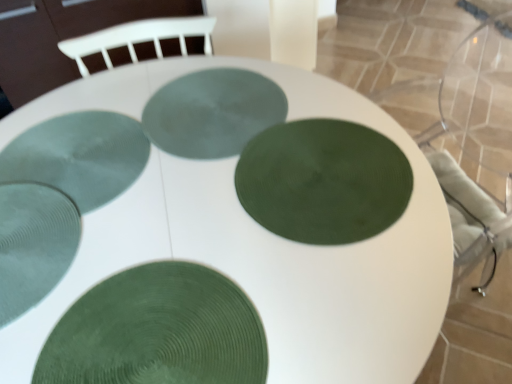
How much space does green textured glass plate at center, which ranks as the third glass plate in front-to-back order, occupy horizontally?

15.52 inches.

At what (x,y) coordinates should I click in order to perform the action: click on green textured glass plate at center, which appears as the 5th glass plate when viewed from the front. Please return your answer as a coordinate pair (x, y). Looking at the image, I should click on (213, 112).

Find the location of a particular element. The height and width of the screenshot is (384, 512). green textured glass plate at center, positioned as the 2th glass plate in back-to-front order is located at coordinates (79, 156).

Where is `green textured plate at center, which appears as the first glass plate when viewed from the front`? This screenshot has height=384, width=512. green textured plate at center, which appears as the first glass plate when viewed from the front is located at coordinates (158, 331).

How different are the orientations of green textured glass plate at center, which appears as the 5th glass plate when viewed from the front, and green textured plate at center, which is the 5th glass plate from back to front, in degrees?

They differ by 176 degrees in their facing directions.

Is green textured glass plate at center, which appears as the 5th glass plate when viewed from the front, aimed at green textured plate at center, which is the 5th glass plate from back to front?

No, green textured glass plate at center, which appears as the 5th glass plate when viewed from the front, is not oriented towards green textured plate at center, which is the 5th glass plate from back to front.

Considering the relative positions of green textured glass plate at center, which appears as the 5th glass plate when viewed from the front, and green textured plate at center, which is the 5th glass plate from back to front, in the image provided, is green textured glass plate at center, which appears as the 5th glass plate when viewed from the front, to the right of green textured plate at center, which is the 5th glass plate from back to front, from the viewer's perspective?

Indeed, green textured glass plate at center, which appears as the 5th glass plate when viewed from the front, is positioned on the right side of green textured plate at center, which is the 5th glass plate from back to front.

Do you think clear textured glass at bottom left, positioned as the 2th glass plate in front-to-back order, is within green textured glass plate at center, positioned as the 2th glass plate in back-to-front order, or outside of it?

clear textured glass at bottom left, positioned as the 2th glass plate in front-to-back order, cannot be found inside green textured glass plate at center, positioned as the 2th glass plate in back-to-front order.

How many degrees apart are the facing directions of clear textured glass at bottom left, the fourth glass plate from the back, and green textured glass plate at center, arranged as the fourth glass plate when viewed from the front?

There is a 48.5-degree angle between the facing directions of clear textured glass at bottom left, the fourth glass plate from the back, and green textured glass plate at center, arranged as the fourth glass plate when viewed from the front.

Measure the distance between clear textured glass at bottom left, positioned as the 2th glass plate in front-to-back order, and green textured glass plate at center, arranged as the fourth glass plate when viewed from the front.

clear textured glass at bottom left, positioned as the 2th glass plate in front-to-back order, and green textured glass plate at center, arranged as the fourth glass plate when viewed from the front, are 5.11 inches apart from each other.

Is clear textured glass at bottom left, positioned as the 2th glass plate in front-to-back order, far from green textured glass plate at center, positioned as the 2th glass plate in back-to-front order?

No.

Does point (239, 327) appear closer or farther from the camera than point (27, 243)?

Clearly, point (239, 327) is closer to the camera than point (27, 243).

Is green textured plate at center, which appears as the first glass plate when viewed from the front, not inside clear textured glass at bottom left, positioned as the 2th glass plate in front-to-back order?

green textured plate at center, which appears as the first glass plate when viewed from the front, lies outside clear textured glass at bottom left, positioned as the 2th glass plate in front-to-back order,'s area.

From the image's perspective, which one is positioned higher, green textured plate at center, which is the 5th glass plate from back to front, or clear textured glass at bottom left, positioned as the 2th glass plate in front-to-back order?

clear textured glass at bottom left, positioned as the 2th glass plate in front-to-back order, from the image's perspective.

Could you tell me if green textured plate at center, which is the 5th glass plate from back to front, is facing clear textured glass at bottom left, positioned as the 2th glass plate in front-to-back order?

No, green textured plate at center, which is the 5th glass plate from back to front, is not aimed at clear textured glass at bottom left, positioned as the 2th glass plate in front-to-back order.

Is the position of green textured glass plate at center, which ranks as the third glass plate in front-to-back order, more distant than that of green textured glass plate at center, which is the 1th glass plate in back-to-front order?

No.

Based on the photo, is green textured glass plate at center, positioned as the 3th glass plate in back-to-front order, not near green textured glass plate at center, which is the 1th glass plate in back-to-front order?

green textured glass plate at center, positioned as the 3th glass plate in back-to-front order, is actually quite close to green textured glass plate at center, which is the 1th glass plate in back-to-front order.

Is point (405, 164) behind point (280, 101)?

No, (405, 164) is closer to viewer.

From the picture: Can you confirm if green textured glass plate at center, which ranks as the third glass plate in front-to-back order, is shorter than green textured glass plate at center, which appears as the 5th glass plate when viewed from the front?

Yes.

Could you measure the distance between green textured glass plate at center, arranged as the fourth glass plate when viewed from the front, and clear textured glass at bottom left, positioned as the 2th glass plate in front-to-back order?

They are 5.11 inches apart.

In the image, is green textured glass plate at center, arranged as the fourth glass plate when viewed from the front, on the left side or the right side of clear textured glass at bottom left, positioned as the 2th glass plate in front-to-back order?

In the image, green textured glass plate at center, arranged as the fourth glass plate when viewed from the front, appears on the right side of clear textured glass at bottom left, positioned as the 2th glass plate in front-to-back order.

Does green textured glass plate at center, arranged as the fourth glass plate when viewed from the front, contain clear textured glass at bottom left, the fourth glass plate from the back?

No, clear textured glass at bottom left, the fourth glass plate from the back, is not a part of green textured glass plate at center, arranged as the fourth glass plate when viewed from the front.

Which is more to the left, clear textured glass at bottom left, positioned as the 2th glass plate in front-to-back order, or green textured plate at center, which appears as the first glass plate when viewed from the front?

clear textured glass at bottom left, positioned as the 2th glass plate in front-to-back order.

Which is correct: clear textured glass at bottom left, positioned as the 2th glass plate in front-to-back order, is inside green textured plate at center, which is the 5th glass plate from back to front, or outside of it?

The correct answer is: outside.

You are a GUI agent. You are given a task and a screenshot of the screen. Output one action in this format:
    pyautogui.click(x=<x>, y=<y>)
    Task: Click on the 2nd glass plate counting from the left side of the green textured plate at center, which is the 5th glass plate from back to front
    
    Given the screenshot: What is the action you would take?
    pyautogui.click(x=33, y=244)

Based on the photo, which object is further away from the camera taking this photo, clear textured glass at bottom left, the fourth glass plate from the back, or green textured plate at center, which is the 5th glass plate from back to front?

clear textured glass at bottom left, the fourth glass plate from the back, is further away from the camera.

Can you confirm if green textured glass plate at center, positioned as the 2th glass plate in back-to-front order, is wider than green textured glass plate at center, which appears as the 5th glass plate when viewed from the front?

Yes.

Is green textured glass plate at center, arranged as the fourth glass plate when viewed from the front, at the right side of green textured glass plate at center, which is the 1th glass plate in back-to-front order?

No.

Could green textured glass plate at center, which appears as the 5th glass plate when viewed from the front, be considered to be inside green textured glass plate at center, positioned as the 2th glass plate in back-to-front order?

No, green textured glass plate at center, which appears as the 5th glass plate when viewed from the front, is not a part of green textured glass plate at center, positioned as the 2th glass plate in back-to-front order.

Who is shorter, green textured glass plate at center, arranged as the fourth glass plate when viewed from the front, or green textured glass plate at center, which appears as the 5th glass plate when viewed from the front?

Standing shorter between the two is green textured glass plate at center, which appears as the 5th glass plate when viewed from the front.

From the green textured plate at center, which is the 5th glass plate from back to front, count 4th glass plates backward and point to it. Please provide its 2D coordinates.

[(213, 112)]

In order to click on the 2nd glass plate above the clear textured glass at bottom left, positioned as the 2th glass plate in front-to-back order (from the image's perspective) in this screenshot , I will do `click(79, 156)`.

From the image, which object appears to be farther from green textured glass plate at center, which appears as the 5th glass plate when viewed from the front, green textured glass plate at center, which ranks as the third glass plate in front-to-back order, or clear textured glass at bottom left, positioned as the 2th glass plate in front-to-back order?

clear textured glass at bottom left, positioned as the 2th glass plate in front-to-back order.

Consider the image. From the image, which object appears to be nearer to green textured glass plate at center, which ranks as the third glass plate in front-to-back order, green textured glass plate at center, which is the 1th glass plate in back-to-front order, or green textured glass plate at center, positioned as the 2th glass plate in back-to-front order?

green textured glass plate at center, which is the 1th glass plate in back-to-front order, lies closer to green textured glass plate at center, which ranks as the third glass plate in front-to-back order, than the other object.

When comparing their distances from green textured glass plate at center, positioned as the 2th glass plate in back-to-front order, does green textured glass plate at center, which is the 1th glass plate in back-to-front order, or green textured plate at center, which is the 5th glass plate from back to front, seem further?

Based on the image, green textured plate at center, which is the 5th glass plate from back to front, appears to be further to green textured glass plate at center, positioned as the 2th glass plate in back-to-front order.

Which object lies nearer to the anchor point clear textured glass at bottom left, positioned as the 2th glass plate in front-to-back order, green textured plate at center, which is the 5th glass plate from back to front, or green textured glass plate at center, arranged as the fourth glass plate when viewed from the front?

Based on the image, green textured glass plate at center, arranged as the fourth glass plate when viewed from the front, appears to be nearer to clear textured glass at bottom left, positioned as the 2th glass plate in front-to-back order.

Considering their positions, is clear textured glass at bottom left, the fourth glass plate from the back, positioned further to green textured glass plate at center, which appears as the 5th glass plate when viewed from the front, than green textured glass plate at center, which ranks as the third glass plate in front-to-back order?

Based on the image, clear textured glass at bottom left, the fourth glass plate from the back, appears to be further to green textured glass plate at center, which appears as the 5th glass plate when viewed from the front.

Looking at the image, which one is located further to green textured glass plate at center, positioned as the 2th glass plate in back-to-front order, green textured plate at center, which appears as the first glass plate when viewed from the front, or green textured glass plate at center, which appears as the 5th glass plate when viewed from the front?

green textured plate at center, which appears as the first glass plate when viewed from the front, lies further to green textured glass plate at center, positioned as the 2th glass plate in back-to-front order, than the other object.

Which object lies nearer to the anchor point green textured glass plate at center, which ranks as the third glass plate in front-to-back order, green textured plate at center, which appears as the first glass plate when viewed from the front, or green textured glass plate at center, which is the 1th glass plate in back-to-front order?

green textured glass plate at center, which is the 1th glass plate in back-to-front order, is positioned closer to the anchor green textured glass plate at center, which ranks as the third glass plate in front-to-back order.

Based on their spatial positions, is green textured glass plate at center, positioned as the 3th glass plate in back-to-front order, or green textured glass plate at center, arranged as the fourth glass plate when viewed from the front, further from green textured plate at center, which is the 5th glass plate from back to front?

The object further to green textured plate at center, which is the 5th glass plate from back to front, is green textured glass plate at center, arranged as the fourth glass plate when viewed from the front.

Where is `glass plate situated between clear textured glass at bottom left, positioned as the 2th glass plate in front-to-back order, and green textured plate at center, which is the 5th glass plate from back to front, from left to right`? glass plate situated between clear textured glass at bottom left, positioned as the 2th glass plate in front-to-back order, and green textured plate at center, which is the 5th glass plate from back to front, from left to right is located at coordinates (79, 156).